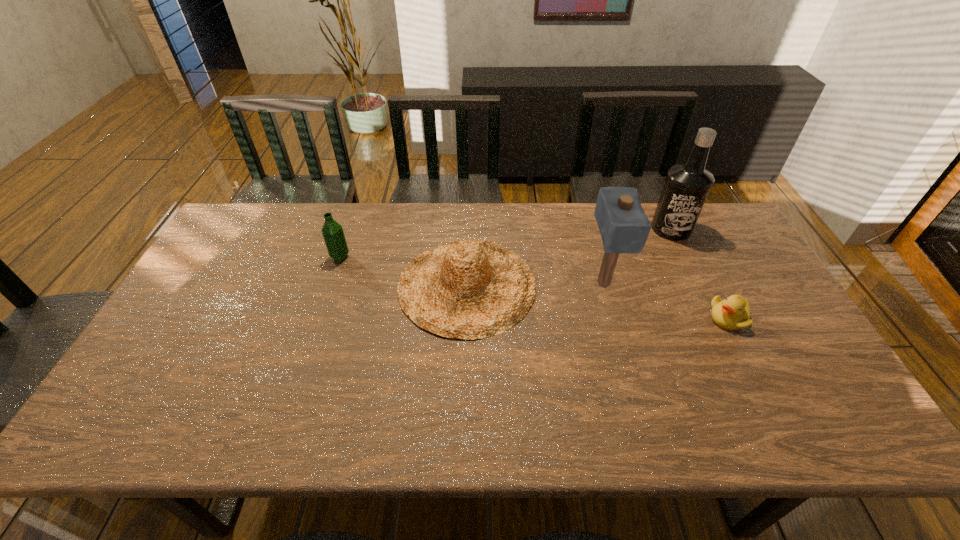
This screenshot has width=960, height=540. What are the coordinates of `blank space at the far edge of the desktop` in the screenshot? It's located at (408, 209).

The image size is (960, 540). In order to click on vacant region at the near edge of the desktop in this screenshot , I will do `click(377, 440)`.

Find the location of a particular element. This screenshot has width=960, height=540. vacant area at the left edge of the desktop is located at coordinates (206, 269).

Identify the location of vacant space at the right edge of the desktop. (751, 304).

Image resolution: width=960 pixels, height=540 pixels. Find the location of `vacant space at the near left corner of the desktop`. vacant space at the near left corner of the desktop is located at coordinates (156, 420).

In the image, there is a desktop. Where is `free space at the far right corner`? free space at the far right corner is located at coordinates (718, 234).

You are a GUI agent. You are given a task and a screenshot of the screen. Output one action in this format:
    pyautogui.click(x=<x>, y=<y>)
    Task: Click on the free space between the liquor and the sunhat
    The width and height of the screenshot is (960, 540).
    Given the screenshot: What is the action you would take?
    pyautogui.click(x=569, y=257)

Find the location of `free space between the fourth shortest object and the liquor`. free space between the fourth shortest object and the liquor is located at coordinates (637, 256).

Locate an element on the screen. The width and height of the screenshot is (960, 540). free space between the third object from right to left and the second shortest object is located at coordinates (535, 284).

In order to click on vacant area between the liquor and the third shortest object in this screenshot , I will do `click(506, 243)`.